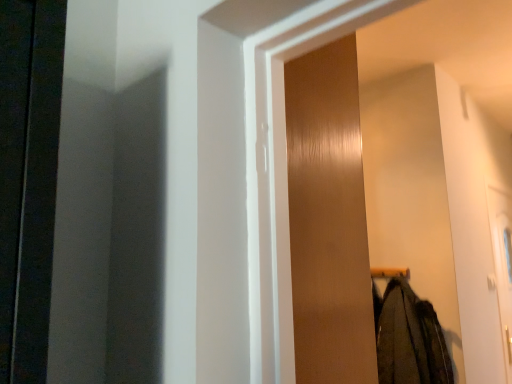
Identify the location of wooden screen door at center. The image size is (512, 384). pyautogui.click(x=328, y=219).

What is the approximate width of wooden screen door at center?

17.87 inches.

Describe the element at coordinates (328, 219) in the screenshot. I see `wooden screen door at center` at that location.

The width and height of the screenshot is (512, 384). Describe the element at coordinates (409, 338) in the screenshot. I see `dark green wool coat at lower right` at that location.

What is the approximate width of dark green wool coat at lower right?

It is 21.81 centimeters.

At what (x,y) coordinates should I click in order to perform the action: click on dark green wool coat at lower right. Please return your answer as a coordinate pair (x, y). Looking at the image, I should click on pos(409,338).

Find the location of `wooden screen door at center`. wooden screen door at center is located at coordinates (328, 219).

Considering the positions of objects wooden screen door at center and dark green wool coat at lower right in the image provided, who is more to the right, wooden screen door at center or dark green wool coat at lower right?

From the viewer's perspective, dark green wool coat at lower right appears more on the right side.

Which is in front, wooden screen door at center or dark green wool coat at lower right?

wooden screen door at center.

Does point (296, 229) appear closer or farther from the camera than point (418, 354)?

Point (296, 229) is closer to the camera than point (418, 354).

From the image's perspective, which is below, wooden screen door at center or dark green wool coat at lower right?

dark green wool coat at lower right.

From a real-world perspective, is wooden screen door at center on top of dark green wool coat at lower right?

Yes, from a real-world perspective, wooden screen door at center is on top of dark green wool coat at lower right.

Is wooden screen door at center wider than dark green wool coat at lower right?

Correct, the width of wooden screen door at center exceeds that of dark green wool coat at lower right.

Looking at this image, considering the relative sizes of wooden screen door at center and dark green wool coat at lower right in the image provided, is wooden screen door at center taller than dark green wool coat at lower right?

Yes, wooden screen door at center is taller than dark green wool coat at lower right.

Can you confirm if wooden screen door at center is bigger than dark green wool coat at lower right?

Yes.

From the picture: Does wooden screen door at center contain dark green wool coat at lower right?

No, dark green wool coat at lower right is located outside of wooden screen door at center.

Is wooden screen door at center far from dark green wool coat at lower right?

Yes.

Could you tell me if wooden screen door at center is turned towards dark green wool coat at lower right?

Yes, wooden screen door at center is turned towards dark green wool coat at lower right.

Locate an element on the screen. The image size is (512, 384). clothing behind the wooden screen door at center is located at coordinates (409, 338).

Is dark green wool coat at lower right to the left or to the right of wooden screen door at center in the image?

Based on their positions, dark green wool coat at lower right is located to the right of wooden screen door at center.

Which is in front, dark green wool coat at lower right or wooden screen door at center?

wooden screen door at center.

Which is nearer, [437,383] or [300,367]?

Point [437,383] appears to be farther away from the viewer than point [300,367].

From the image's perspective, who appears lower, dark green wool coat at lower right or wooden screen door at center?

dark green wool coat at lower right.

From a real-world perspective, is dark green wool coat at lower right physically above wooden screen door at center?

No, from a real-world perspective, dark green wool coat at lower right is not on top of wooden screen door at center.

Does dark green wool coat at lower right have a greater width compared to wooden screen door at center?

No.

Which of these two, dark green wool coat at lower right or wooden screen door at center, stands taller?

wooden screen door at center is taller.

Is dark green wool coat at lower right smaller than wooden screen door at center?

Yes.

Could wooden screen door at center be considered to be inside dark green wool coat at lower right?

That's incorrect, wooden screen door at center is not inside dark green wool coat at lower right.

Are dark green wool coat at lower right and wooden screen door at center beside each other?

No, dark green wool coat at lower right is not in contact with wooden screen door at center.

Could you tell me if dark green wool coat at lower right is turned towards wooden screen door at center?

Yes, dark green wool coat at lower right is oriented towards wooden screen door at center.

What's the angular difference between dark green wool coat at lower right and wooden screen door at center's facing directions?

176 degrees.

You are a GUI agent. You are given a task and a screenshot of the screen. Output one action in this format:
    pyautogui.click(x=<x>, y=<y>)
    Task: Click on the clothing behind the wooden screen door at center
    This screenshot has width=512, height=384.
    Given the screenshot: What is the action you would take?
    pyautogui.click(x=409, y=338)

At what (x,y) coordinates should I click in order to perform the action: click on clothing on the right of the wooden screen door at center. Please return your answer as a coordinate pair (x, y). Looking at the image, I should click on (409, 338).

The image size is (512, 384). In order to click on screen door above the dark green wool coat at lower right (from a real-world perspective) in this screenshot , I will do `click(328, 219)`.